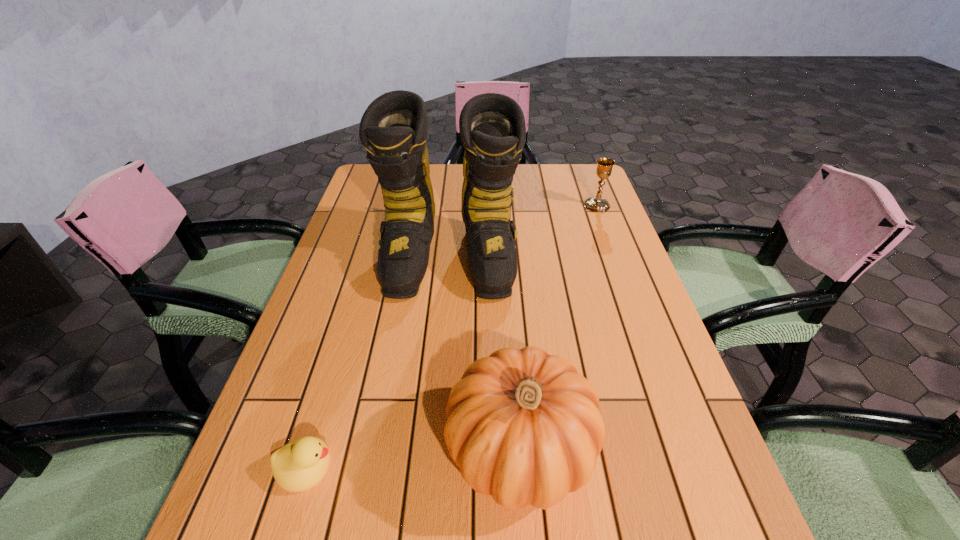
Where is `the third closest object to the rightmost object`? Image resolution: width=960 pixels, height=540 pixels. the third closest object to the rightmost object is located at coordinates (298, 466).

Find the location of a particular element. The width and height of the screenshot is (960, 540). vacant area in the image that satisfies the following two spatial constraints: 1. on the back side of the third tallest object; 2. on the left side of the pumpkin is located at coordinates (502, 205).